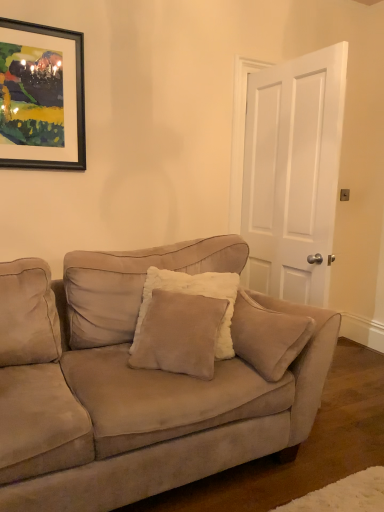
Question: From the image's perspective, is white matte door at center positioned above or below black matte picture frame at upper left?

Choices:
 (A) above
 (B) below

Answer: (B)

Question: From their relative heights in the image, would you say white matte door at center is taller or shorter than black matte picture frame at upper left?

Choices:
 (A) short
 (B) tall

Answer: (B)

Question: Which is nearer to the white matte door at center?

Choices:
 (A) black matte picture frame at upper left
 (B) suede couch at center
 (C) suede/velvet pillow at center

Answer: (C)

Question: Which of these objects is positioned farthest from the black matte picture frame at upper left?

Choices:
 (A) white matte door at center
 (B) suede couch at center
 (C) suede/velvet pillow at center

Answer: (A)